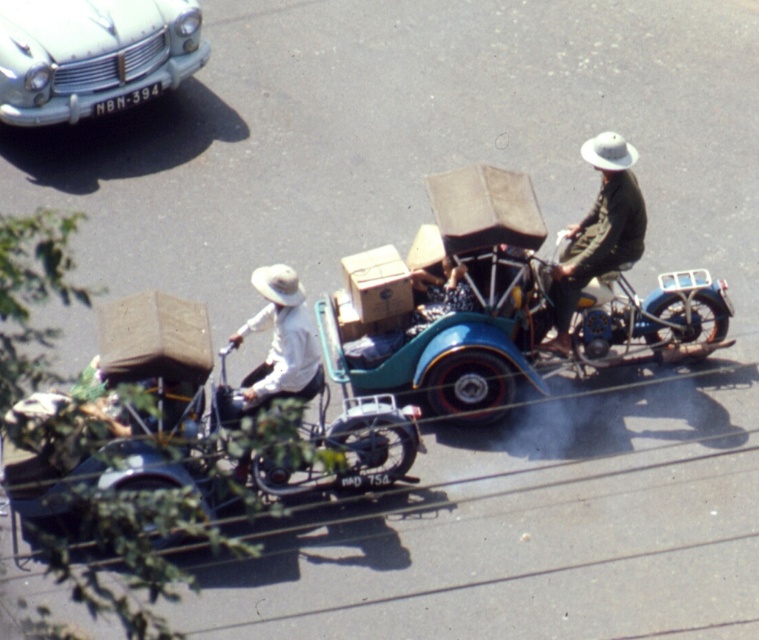
You are navigating a narrow alley and need to determine the position of the light blue metallic car at upper left relative to the rickshaws. Based on the coordinates provided, can you tell if the car is positioned to the left or right of the rickshaws?

The light blue metallic car at upper left is located at point (93, 54), which places it to the left of the rickshaws since its x coordinate is lower than the rickshaws.

You are a delivery person who needs to pass between the shiny chrome motorcycle at center right and the white matte hat at center. Can your 1.2 meter wide delivery cart fit through the space between them?

The shiny chrome motorcycle at center right is larger than the white matte hat at center, but the exact distance between them isn

You are a delivery person who needs to pass between the shiny chrome motorcycle at center right and the white matte hat at center. Can you fit through the space between them without bending down?

The shiny chrome motorcycle at center right has a lesser height compared to white matte hat at center, so the space between them may allow you to pass without bending down. However, since the motorcycle is shorter, you might need to duck slightly depending on the exact clearance.